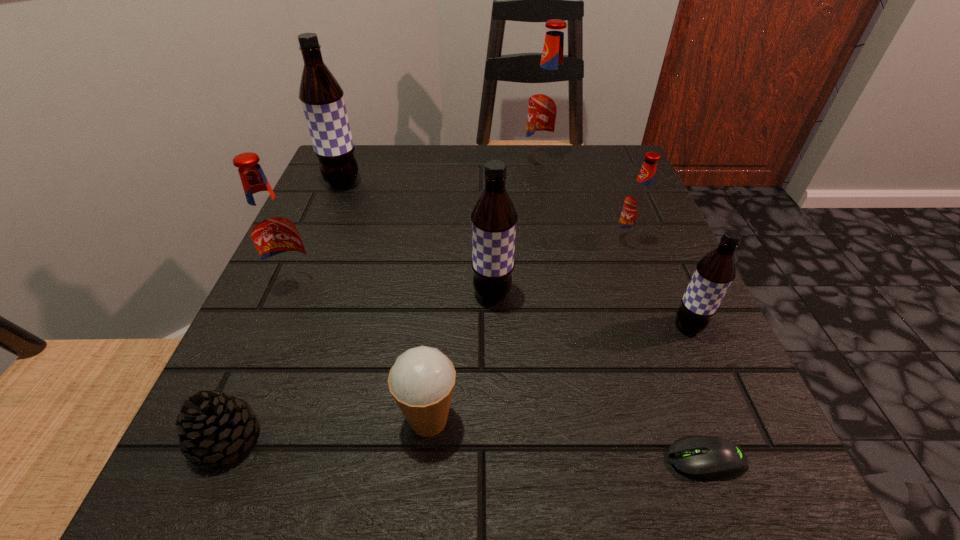
Where is `pinecone positioned at the left edge`? pinecone positioned at the left edge is located at coordinates (211, 427).

You are a GUI agent. You are given a task and a screenshot of the screen. Output one action in this format:
    pyautogui.click(x=<x>, y=<y>)
    Task: Click on the computer mouse located in the right edge section of the desktop
    
    Given the screenshot: What is the action you would take?
    pyautogui.click(x=705, y=457)

Where is `object that is at the far left corner`? object that is at the far left corner is located at coordinates (322, 99).

The image size is (960, 540). Identify the location of object at the near left corner. (211, 427).

Find the location of a particular element. object located at the near right corner is located at coordinates tap(705, 457).

Find the location of a particular element. Image resolution: width=960 pixels, height=540 pixels. free spot at the far edge of the desktop is located at coordinates (512, 190).

Locate an element on the screen. vacant space at the near edge of the desktop is located at coordinates (553, 458).

This screenshot has height=540, width=960. Find the location of `vacant area at the left edge`. vacant area at the left edge is located at coordinates 343,324.

I want to click on vacant space at the right edge of the desktop, so click(596, 235).

At what (x,y) coordinates should I click in order to perform the action: click on free space at the near left corner of the desktop. Please return your answer as a coordinate pair (x, y). The image size is (960, 540). Looking at the image, I should click on [x=192, y=466].